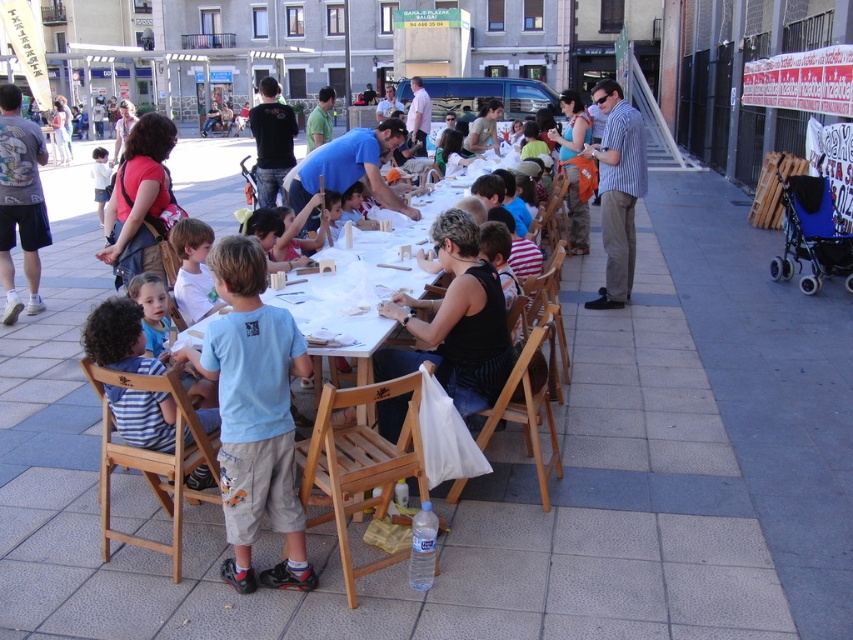
Does striped shirt at right appear under blue shirt at center?

Incorrect, striped shirt at right is not positioned below blue shirt at center.

Is point (633, 156) positioned in front of point (380, 138)?

Yes, it is.

Where is `striped shirt at right`? This screenshot has width=853, height=640. striped shirt at right is located at coordinates (618, 189).

Is matte black t-shirt at left above black cotton shirt at upper center?

Actually, matte black t-shirt at left is below black cotton shirt at upper center.

Which is behind, point (3, 317) or point (259, 115)?

The point (259, 115) is more distant.

Is point (32, 305) positioned after point (289, 108)?

No, (32, 305) is closer to viewer.

Where is `matte black t-shirt at left`? matte black t-shirt at left is located at coordinates (20, 202).

Is light blue t-shirt at center bigger than blue shirt at center?

No.

Who is lower down, light blue t-shirt at center or blue shirt at center?

Positioned lower is light blue t-shirt at center.

Measure the distance between light blue t-shirt at center and camera.

They are 9.38 feet apart.

Identify the location of light blue t-shirt at center. (254, 413).